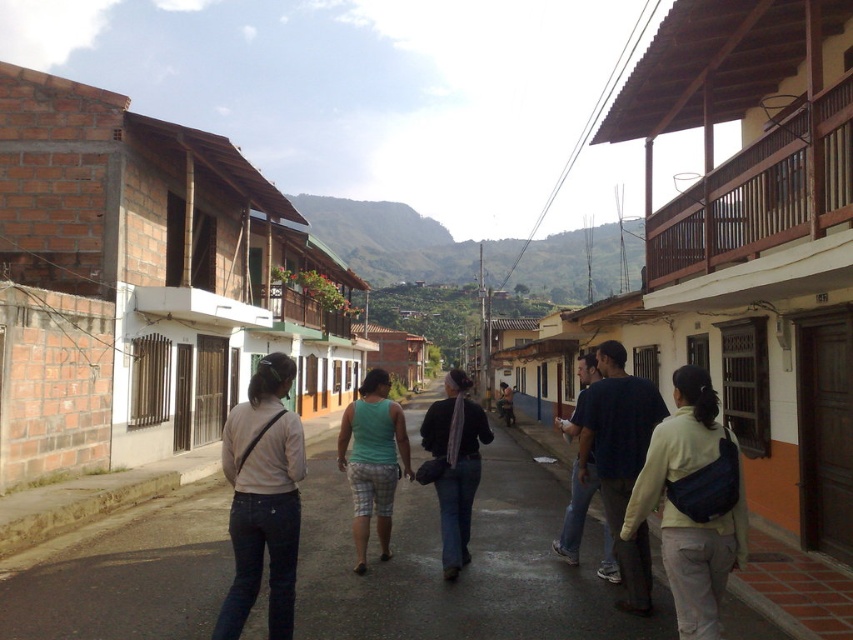
You are standing at the point with coordinates point (669, 476) and want to walk towards the point with coordinates point (599, 564). Which direction should you move relative to your current position?

You should move backward because point (669, 476) is in front of point (599, 564).

You are a traveler who wants to pack your clothes into a small backpack. You have a green fabric shorts at center and a green fabric tank top at center. Which item will take up more space in your backpack?

The green fabric shorts at center is bigger than the green fabric tank top at center, so it will take up more space in the backpack.

You are standing at point (387, 502) and want to walk to point (672, 513). Which direction should you move relative to your current position?

You should move forward because point (672, 513) is in front of point (387, 502).